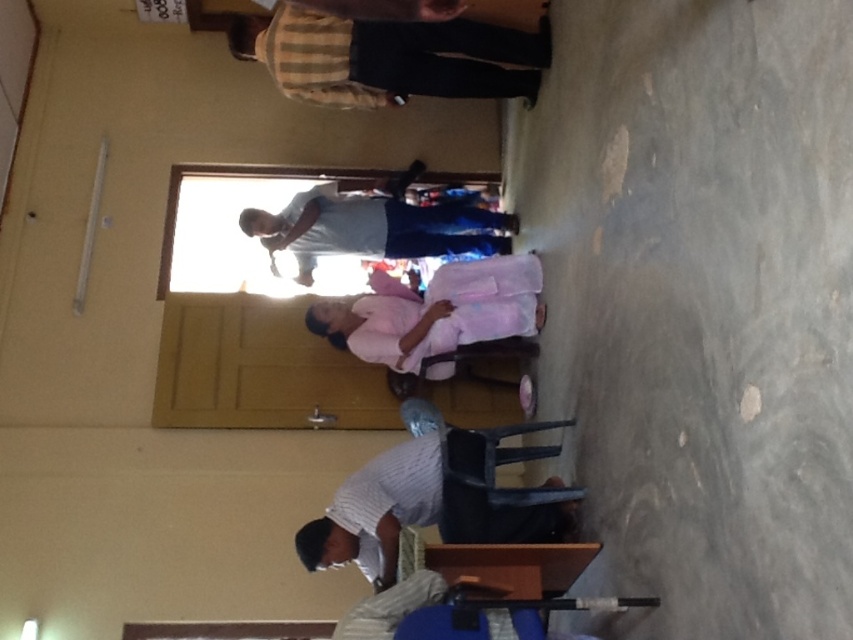
You are observing a person in a room. You see a striped cotton shirt at upper center and a matte gray shirt at center. Which shirt is located higher up?

The striped cotton shirt at upper center is located higher up than the matte gray shirt at center.